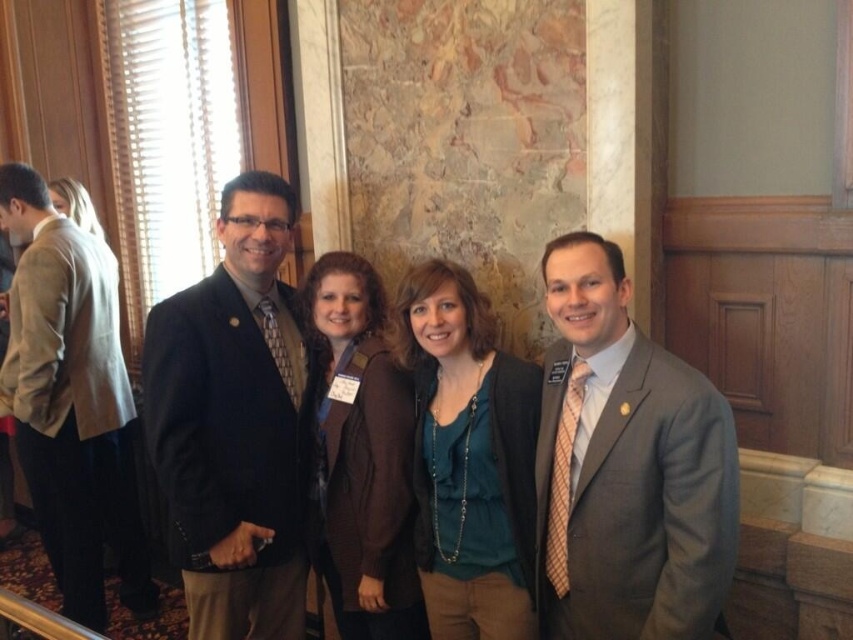
Where is `teal jersey at center`? This screenshot has height=640, width=853. teal jersey at center is located at coordinates (469, 458).

Which is more to the left, teal jersey at center or brown leather jacket at center?

brown leather jacket at center

Between point (463, 403) and point (328, 358), which one is positioned in front?

Positioned in front is point (463, 403).

Locate an element on the screen. The image size is (853, 640). teal jersey at center is located at coordinates (469, 458).

Based on the photo, can you confirm if gray suit at center is positioned above brown leather jacket at center?

Correct, gray suit at center is located above brown leather jacket at center.

Does gray suit at center have a smaller size compared to brown leather jacket at center?

No.

This screenshot has height=640, width=853. What do you see at coordinates (625, 467) in the screenshot?
I see `gray suit at center` at bounding box center [625, 467].

Identify the location of gray suit at center. (625, 467).

Find the location of a particular element. The width and height of the screenshot is (853, 640). light beige suit at left is located at coordinates (71, 401).

Which of these two, light beige suit at left or brown leather jacket at center, stands taller?

Standing taller between the two is light beige suit at left.

The image size is (853, 640). Describe the element at coordinates (71, 401) in the screenshot. I see `light beige suit at left` at that location.

The width and height of the screenshot is (853, 640). Find the location of `light beige suit at left`. light beige suit at left is located at coordinates (71, 401).